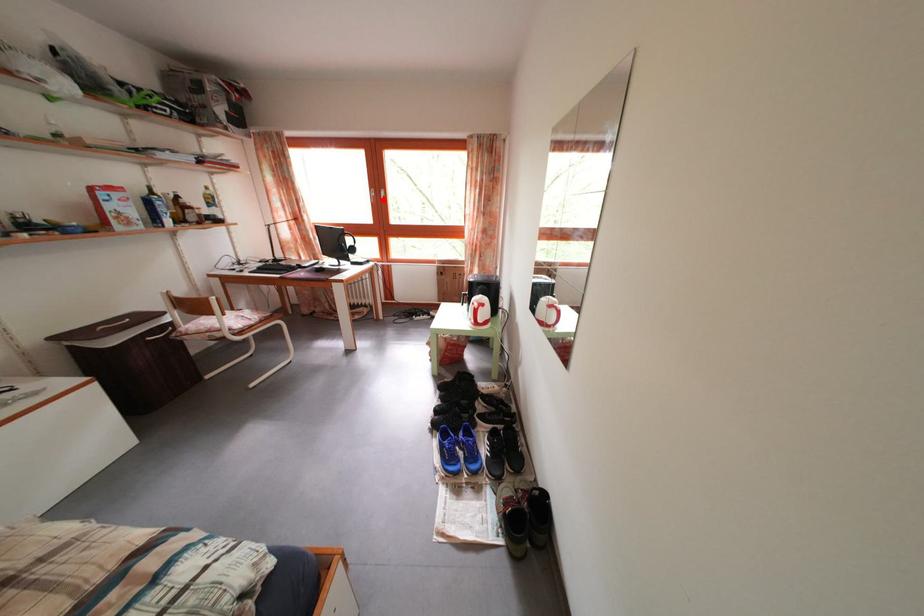
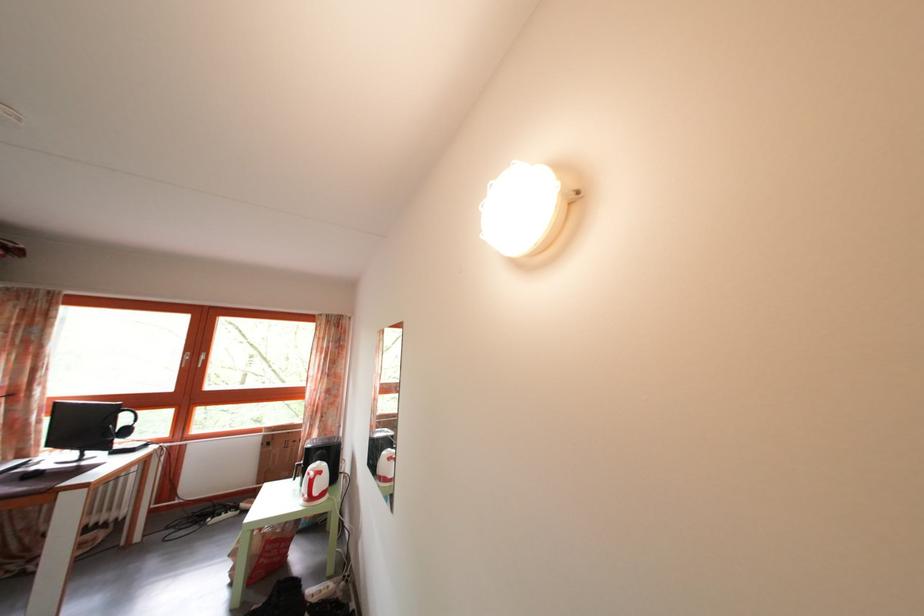
Where in the second image is the point corresponding to the highlighted location from the first image?

(199, 363)